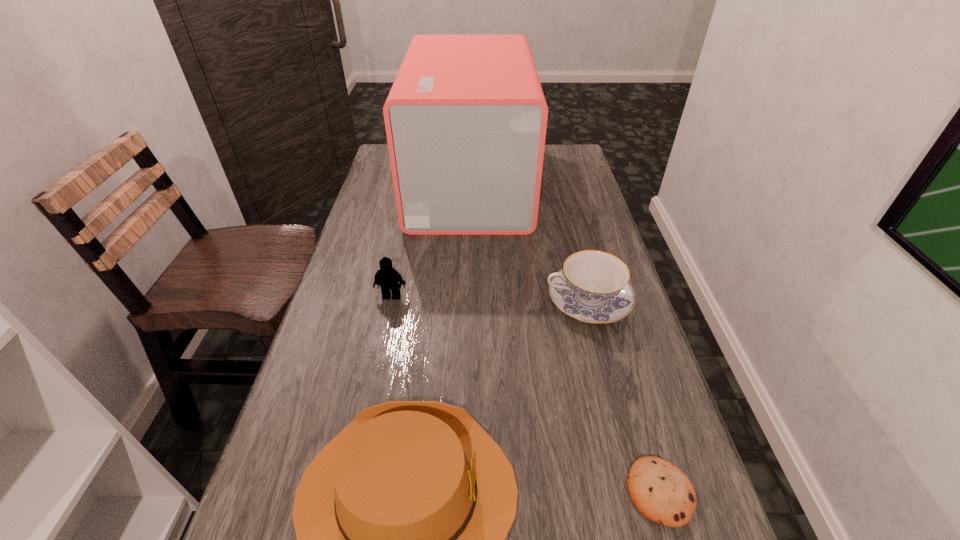
Identify the location of vacant area situated on the left of the shortest object. Image resolution: width=960 pixels, height=540 pixels. (591, 492).

Image resolution: width=960 pixels, height=540 pixels. What are the coordinates of `object that is positioned at the far edge` in the screenshot? It's located at (466, 117).

Locate an element on the screen. box that is positioned at the left edge is located at coordinates (466, 117).

Image resolution: width=960 pixels, height=540 pixels. I want to click on Lego positioned at the left edge, so click(x=387, y=277).

You are a GUI agent. You are given a task and a screenshot of the screen. Output one action in this format:
    pyautogui.click(x=<x>, y=<y>)
    Task: Click on the chinaware located in the right edge section of the desktop
    This screenshot has width=960, height=540.
    Given the screenshot: What is the action you would take?
    pyautogui.click(x=593, y=286)

Identify the location of cookie that is at the right edge. (x=660, y=491).

The height and width of the screenshot is (540, 960). What are the coordinates of `object located at the far left corner` in the screenshot? It's located at (466, 117).

You are a GUI agent. You are given a task and a screenshot of the screen. Output one action in this format:
    pyautogui.click(x=<x>, y=<y>)
    Task: Click on the vacant region at the left edge
    
    Given the screenshot: What is the action you would take?
    pyautogui.click(x=390, y=202)

At what (x,y) coordinates should I click in order to perform the action: click on free space at the right edge of the desktop. Please return your answer as a coordinate pair (x, y). This screenshot has height=540, width=960. Looking at the image, I should click on (582, 202).

Find the location of `free location at the far left corner of the desktop`. free location at the far left corner of the desktop is located at coordinates (379, 163).